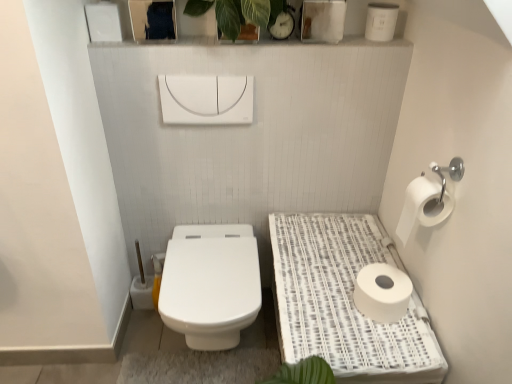
Image resolution: width=512 pixels, height=384 pixels. Find the location of `free space above white glossy toilet at center (from a real-world perspective)`. free space above white glossy toilet at center (from a real-world perspective) is located at coordinates (208, 263).